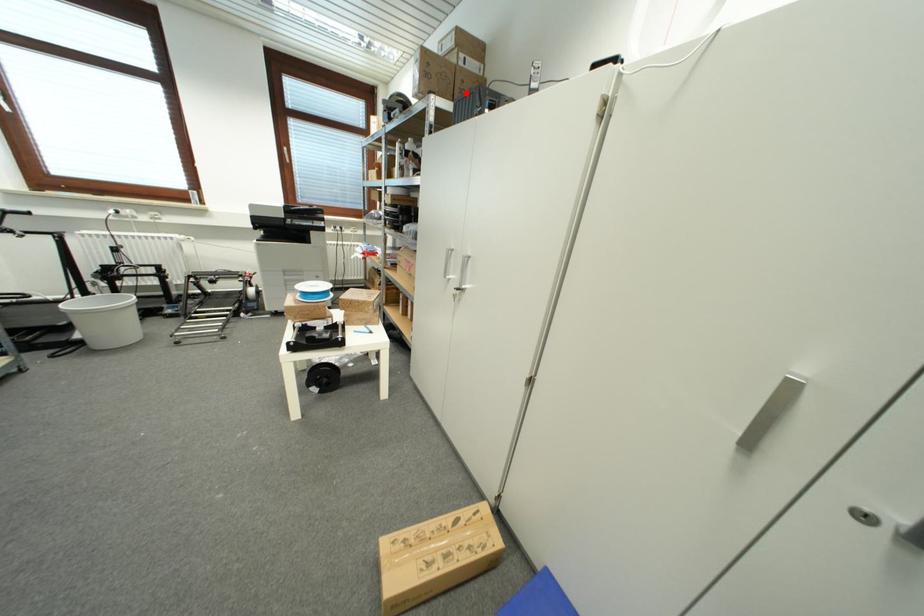
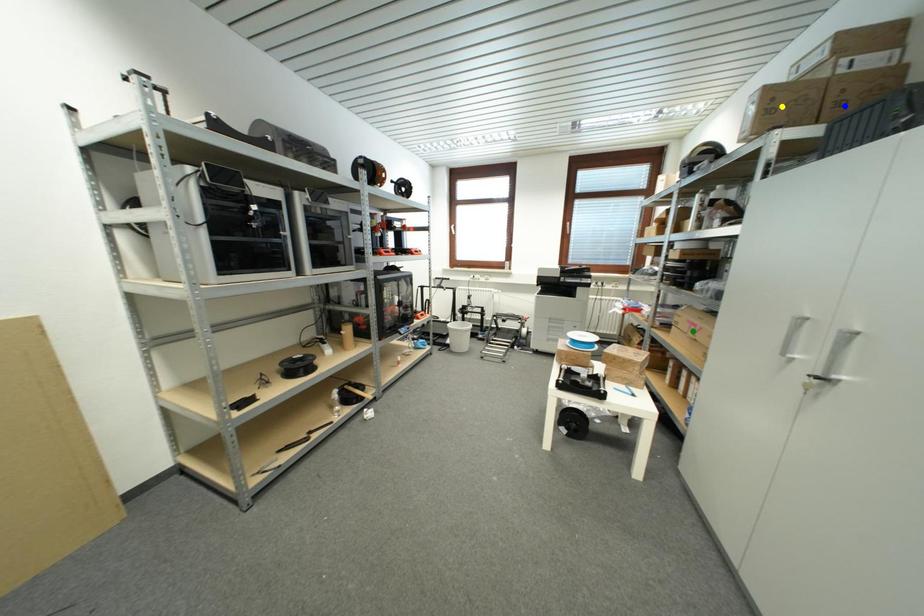
Question: I am providing you with two images of the same scene from different viewpoints. A red point is marked on the first image. You are given multiple points on the second image. Which mark in image 2 goes with the point in image 1?

Choices:
 (A) yellow point
 (B) green point
 (C) blue point

Answer: (C)